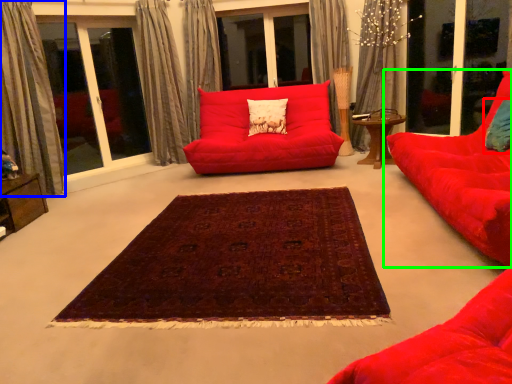
Question: Estimate the real-world distances between objects in this image. Which object is farther from pillow (highlighted by a red box), curtain (highlighted by a blue box) or studio couch (highlighted by a green box)?

Choices:
 (A) curtain
 (B) studio couch

Answer: (A)